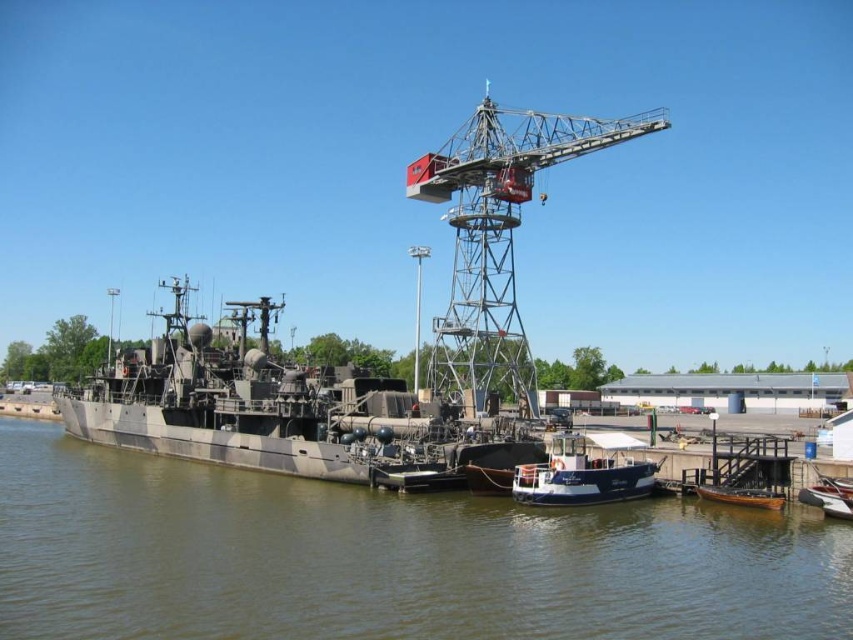
Between camouflage paint military ship at left and wooden boat at lower right, which one appears on the left side from the viewer's perspective?

camouflage paint military ship at left

Can you confirm if camouflage paint military ship at left is positioned to the right of wooden boat at lower right?

In fact, camouflage paint military ship at left is to the left of wooden boat at lower right.

The width and height of the screenshot is (853, 640). What do you see at coordinates (271, 410) in the screenshot? I see `camouflage paint military ship at left` at bounding box center [271, 410].

Where is `camouflage paint military ship at left`? Image resolution: width=853 pixels, height=640 pixels. camouflage paint military ship at left is located at coordinates (271, 410).

Between metallic gray crane at center and metallic silver boat at lower right, which one appears on the right side from the viewer's perspective?

From the viewer's perspective, metallic silver boat at lower right appears more on the right side.

Between metallic gray crane at center and metallic silver boat at lower right, which one is positioned lower?

metallic silver boat at lower right

What are the coordinates of `metallic gray crane at center` in the screenshot? It's located at (497, 240).

I want to click on metallic gray crane at center, so click(x=497, y=240).

Can you confirm if metallic gray crane at center is wider than wooden boat at lower right?

Correct, the width of metallic gray crane at center exceeds that of wooden boat at lower right.

Who is shorter, metallic gray crane at center or wooden boat at lower right?

Standing shorter between the two is wooden boat at lower right.

Does point (534, 116) come farther from viewer compared to point (780, 492)?

Yes.

The image size is (853, 640). Find the location of `metallic gray crane at center`. metallic gray crane at center is located at coordinates (497, 240).